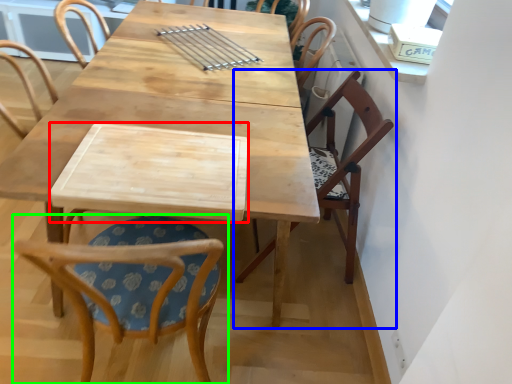
Question: Estimate the real-world distances between objects in this image. Which object is farther from plank (highlighted by a red box), chair (highlighted by a blue box) or chair (highlighted by a green box)?

Choices:
 (A) chair
 (B) chair

Answer: (A)